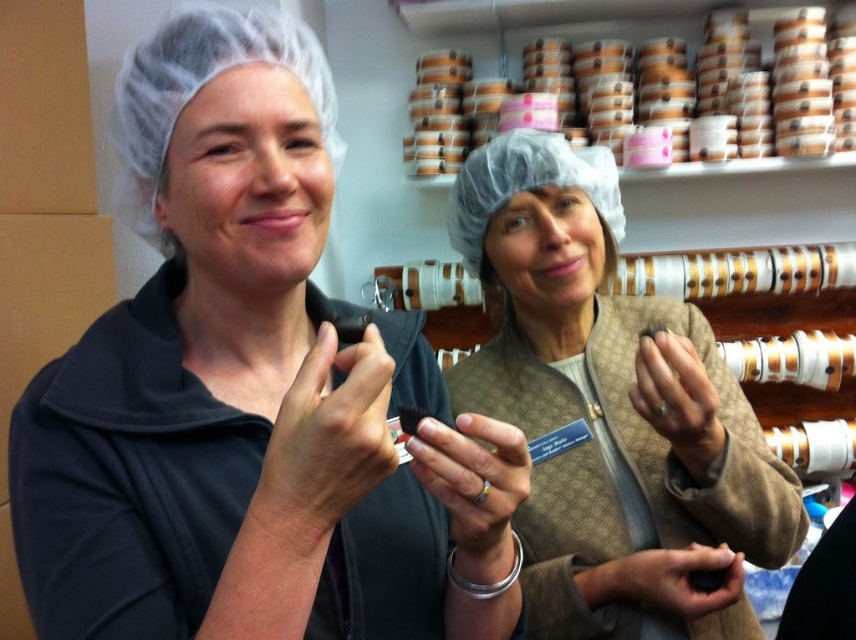
Is matte black chocolate at center below matte brown jacket at center?

Incorrect, matte black chocolate at center is not positioned below matte brown jacket at center.

Which of these two, matte black chocolate at center or matte brown jacket at center, stands shorter?

With less height is matte black chocolate at center.

Is point (271, 492) farther from viewer compared to point (645, 344)?

No, (271, 492) is in front of (645, 344).

This screenshot has height=640, width=856. I want to click on matte black chocolate at center, so click(250, 394).